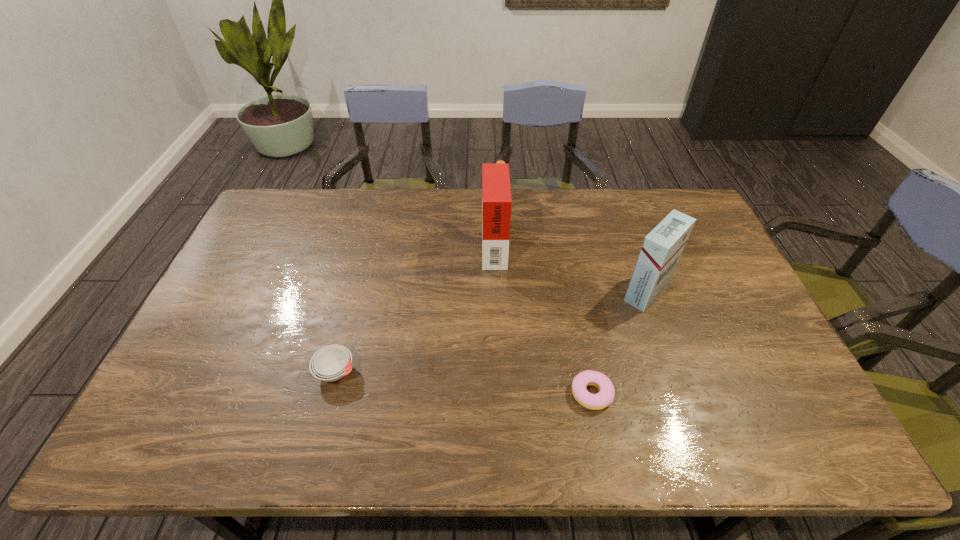
Find the location of `free space between the second farthest object and the leftmost object`. free space between the second farthest object and the leftmost object is located at coordinates (492, 331).

This screenshot has width=960, height=540. I want to click on free space between the left cigarette case and the leftmost object, so point(415,308).

Where is `free space between the second object from right to left and the second shortest object`? The height and width of the screenshot is (540, 960). free space between the second object from right to left and the second shortest object is located at coordinates (464, 382).

Identify the location of free space between the second object from left to right and the second shortest object. This screenshot has height=540, width=960. (415, 308).

This screenshot has width=960, height=540. Identify the location of free space between the right cigarette case and the third object from right to left. (570, 267).

Locate an element on the screen. vacant area that lies between the second object from right to left and the third tallest object is located at coordinates click(464, 382).

Find the location of a particular element. vacant space that is in between the farthest object and the rightmost object is located at coordinates (570, 267).

At what (x,y) coordinates should I click in order to perform the action: click on vacant area that lies between the third object from right to left and the doughnut. Please return your answer as a coordinate pair (x, y). Looking at the image, I should click on (542, 319).

You are a GUI agent. You are given a task and a screenshot of the screen. Output one action in this format:
    pyautogui.click(x=<x>, y=<y>)
    Task: Click on the free space between the third nearest object and the leftmost object
    
    Given the screenshot: What is the action you would take?
    pyautogui.click(x=492, y=331)

What are the coordinates of `unoccupied position between the second shortest object and the nearer cigarette case` in the screenshot? It's located at (492, 331).